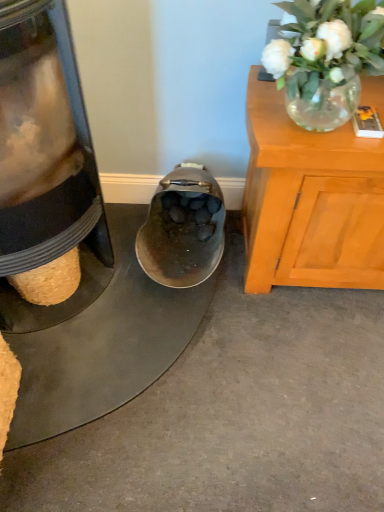
What are the coordinates of `vacant region below metallic bowl at center (from a real-world perspective)` in the screenshot? It's located at (129, 359).